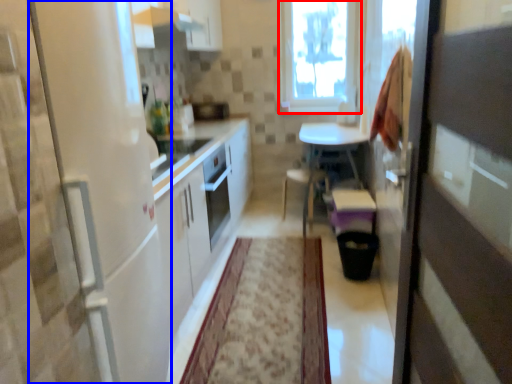
Question: Which point is further to the camera, window (highlighted by a red box) or screen door (highlighted by a blue box)?

Choices:
 (A) window
 (B) screen door

Answer: (A)